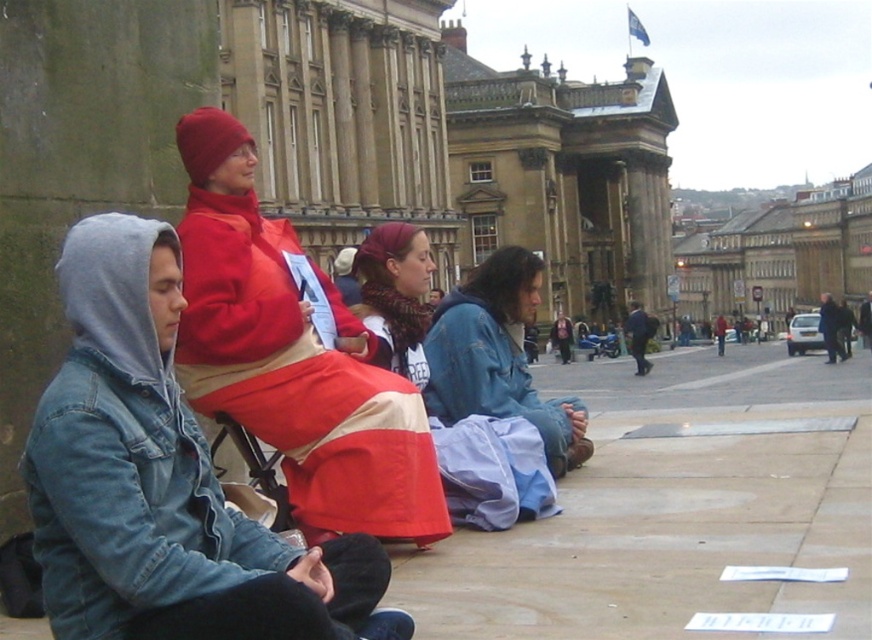
Between point (104, 250) and point (416, 228), which one is positioned in front?

Positioned in front is point (104, 250).

Is denim jacket at left bigger than knitted red scarf at center?

Actually, denim jacket at left might be smaller than knitted red scarf at center.

What do you see at coordinates (162, 481) in the screenshot? I see `denim jacket at left` at bounding box center [162, 481].

Locate an element on the screen. The height and width of the screenshot is (640, 872). denim jacket at left is located at coordinates (162, 481).

Is point (114, 499) closer to camera compared to point (564, 406)?

Yes, point (114, 499) is in front of point (564, 406).

Is denim jacket at left wider than blue denim jacket at center?

Yes.

Looking at this image, who is more distant from viewer, (69, 378) or (506, 408)?

Positioned behind is point (506, 408).

Image resolution: width=872 pixels, height=640 pixels. In order to click on denim jacket at left in this screenshot , I will do `click(162, 481)`.

Between matte red coat at center and blue denim jacket at center, which one has less height?

blue denim jacket at center

Can you confirm if matte red coat at center is positioned below blue denim jacket at center?

Correct, matte red coat at center is located below blue denim jacket at center.

Which is behind, point (209, 346) or point (559, 436)?

The point (559, 436) is behind.

The width and height of the screenshot is (872, 640). In order to click on matte red coat at center in this screenshot , I will do `click(293, 356)`.